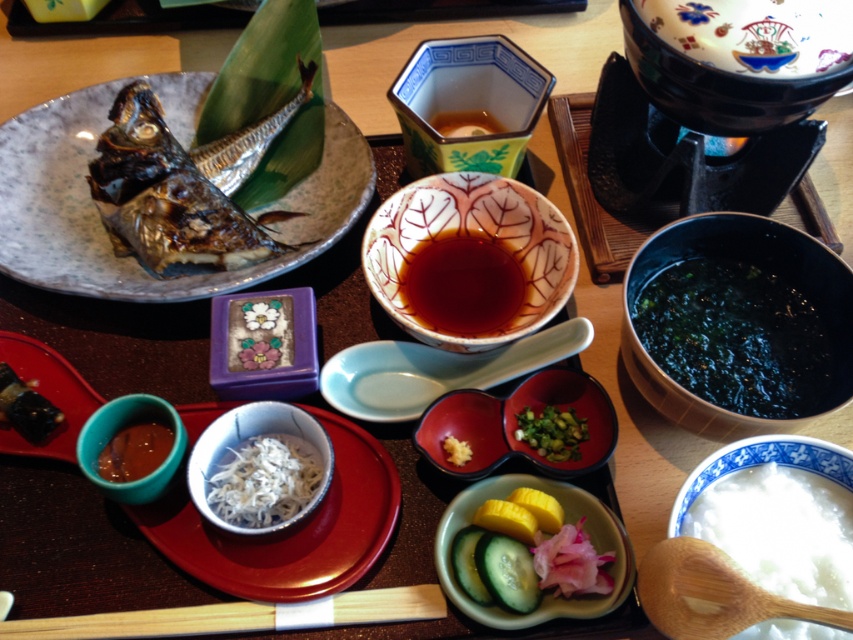
You are a customer at this Japanese restaurant and want to reach for both the white porcelain rice bowl at lower right and the slightly glossy brown sauce at lower left. Which one is physically closer to you?

The white porcelain rice bowl at lower right is closer to the viewer than the slightly glossy brown sauce at lower left, so you can reach it first.

You are a customer at the restaurant and want to reach for the slightly glossy brown sauce at lower left. Considering your arm can comfortably reach 25 inches, will you be able to grab it without moving your chair?

The distance of slightly glossy brown sauce at lower left from viewer is 27.09 inches, which is beyond your arm reach of 25 inches. You will need to move your chair closer to grab it.